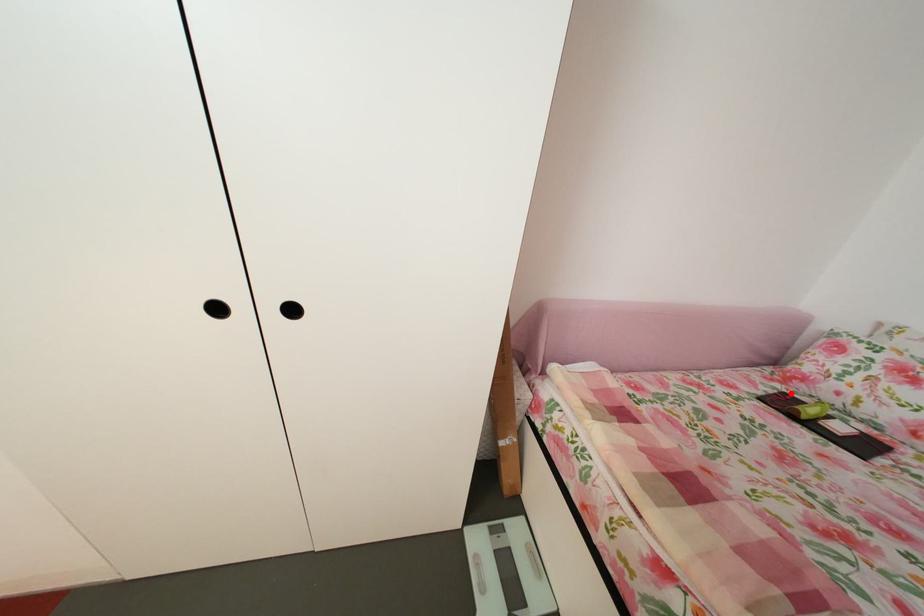
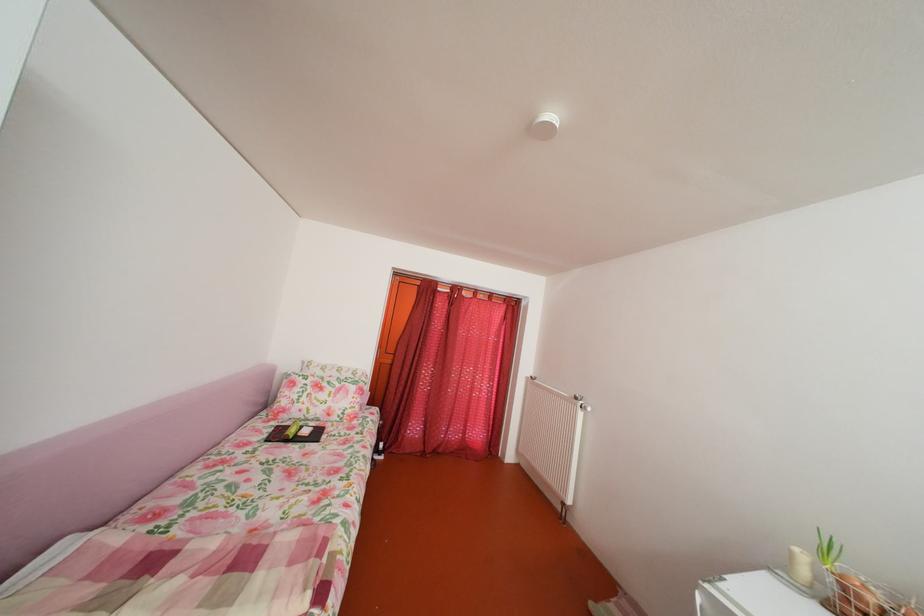
Where in the second image is the point corresponding to the highlighted location from the first image?

(286, 430)